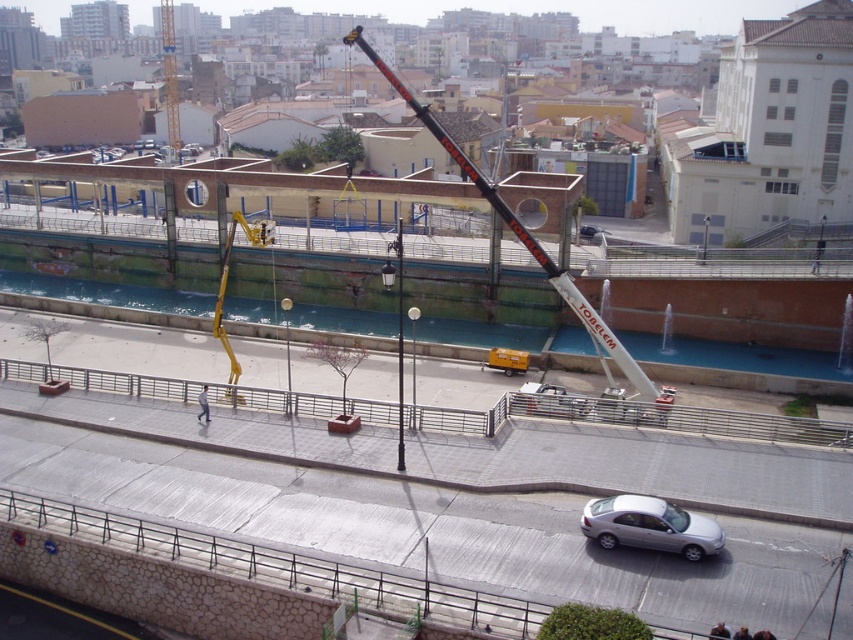
Question: Which of the following is the farthest from the observer?

Choices:
 (A) white fabric construction worker at center
 (B) black metallic crane at center

Answer: (A)

Question: Considering the relative positions of black metallic crane at center and yellow metallic crane at upper left in the image provided, where is black metallic crane at center located with respect to yellow metallic crane at upper left?

Choices:
 (A) left
 (B) right

Answer: (B)

Question: Does black metallic crane at center have a smaller size compared to yellow metallic crane at center?

Choices:
 (A) yes
 (B) no

Answer: (B)

Question: Which of these objects is positioned farthest from the silver metallic car at lower center?

Choices:
 (A) yellow metallic crane at center
 (B) white fabric construction worker at center
 (C) yellow metallic crane at upper left

Answer: (C)

Question: Does yellow metallic crane at center have a lesser width compared to white fabric construction worker at center?

Choices:
 (A) no
 (B) yes

Answer: (A)

Question: Which is farther from the yellow metallic crane at center?

Choices:
 (A) yellow metallic crane at upper left
 (B) black metallic crane at center

Answer: (A)